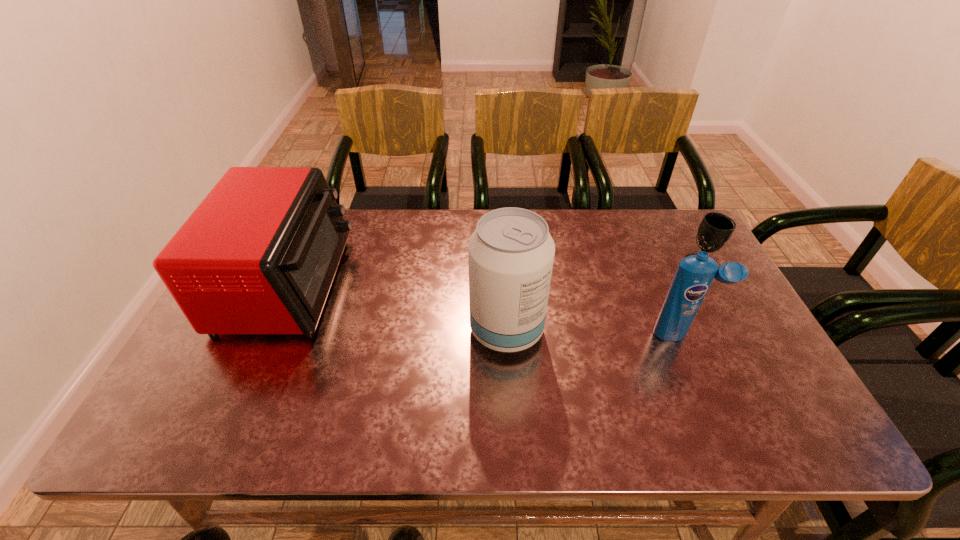
In order to click on free space at the right edge of the desktop in this screenshot , I will do `click(734, 301)`.

Locate an element on the screen. vacant space at the far right corner of the desktop is located at coordinates (663, 209).

What are the coordinates of `vacant space at the near right corner` in the screenshot? It's located at (794, 427).

This screenshot has width=960, height=540. I want to click on unoccupied area between the second object from left to right and the third object from left to right, so coord(594,332).

The width and height of the screenshot is (960, 540). In order to click on unoccupied area between the shortest object and the third object from right to left in this screenshot , I will do `click(603, 296)`.

Locate an element on the screen. free space that is in between the leftmost object and the alcohol is located at coordinates (397, 307).

Where is `the third closest object relative to the tallest object`? the third closest object relative to the tallest object is located at coordinates (715, 230).

Locate which object ranks second in proximity to the shampoo. Please provide its 2D coordinates. Your answer should be formatted as a tuple, i.e. [(x, y)], where the tuple contains the x and y coordinates of a point satisfying the conditions above.

[(511, 253)]

You are a GUI agent. You are given a task and a screenshot of the screen. Output one action in this format:
    pyautogui.click(x=<x>, y=<y>)
    Task: Click on the vacant space that satisfies the following two spatial constraints: 1. on the front-facing side of the second object from right to left; 2. on the right side of the toaster oven
    
    Given the screenshot: What is the action you would take?
    pyautogui.click(x=266, y=334)

Where is `blank area in the image that satisfies the following two spatial constraints: 1. on the front-facing side of the leftmost object; 2. on the left side of the second object from right to left`? This screenshot has width=960, height=540. blank area in the image that satisfies the following two spatial constraints: 1. on the front-facing side of the leftmost object; 2. on the left side of the second object from right to left is located at coordinates (266, 334).